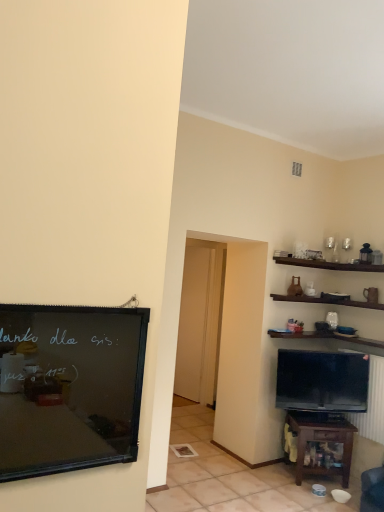
Question: Is brown wooden table at lower right positioned before matte black tv at lower right?

Choices:
 (A) no
 (B) yes

Answer: (B)

Question: From the image's perspective, does brown wooden table at lower right appear lower than matte black tv at lower right?

Choices:
 (A) yes
 (B) no

Answer: (A)

Question: Can you confirm if brown wooden table at lower right is positioned to the left of matte black tv at lower right?

Choices:
 (A) yes
 (B) no

Answer: (A)

Question: Does brown wooden table at lower right contain matte black tv at lower right?

Choices:
 (A) no
 (B) yes

Answer: (A)

Question: Can you confirm if brown wooden table at lower right is shorter than matte black tv at lower right?

Choices:
 (A) no
 (B) yes

Answer: (B)

Question: From the image's perspective, relative to black matte bulletin board at left, is transparent glass door at center above or below?

Choices:
 (A) above
 (B) below

Answer: (B)

Question: Relative to black matte bulletin board at left, is transparent glass door at center in front or behind?

Choices:
 (A) behind
 (B) front

Answer: (A)

Question: From a real-world perspective, is transparent glass door at center above or below black matte bulletin board at left?

Choices:
 (A) above
 (B) below

Answer: (B)

Question: Is transparent glass door at center to the left or to the right of black matte bulletin board at left in the image?

Choices:
 (A) left
 (B) right

Answer: (B)

Question: Is point (185, 348) positioned closer to the camera than point (319, 385)?

Choices:
 (A) closer
 (B) farther

Answer: (B)

Question: In terms of size, does transparent glass door at center appear bigger or smaller than matte black tv at lower right?

Choices:
 (A) small
 (B) big

Answer: (A)

Question: From a real-world perspective, is transparent glass door at center positioned above or below matte black tv at lower right?

Choices:
 (A) above
 (B) below

Answer: (A)

Question: In the image, is transparent glass door at center on the left side or the right side of matte black tv at lower right?

Choices:
 (A) right
 (B) left

Answer: (B)

Question: Is brown wooden table at lower right spatially inside matte black tv at lower right, or outside of it?

Choices:
 (A) inside
 (B) outside

Answer: (B)

Question: Is brown wooden table at lower right taller or shorter than matte black tv at lower right?

Choices:
 (A) short
 (B) tall

Answer: (A)